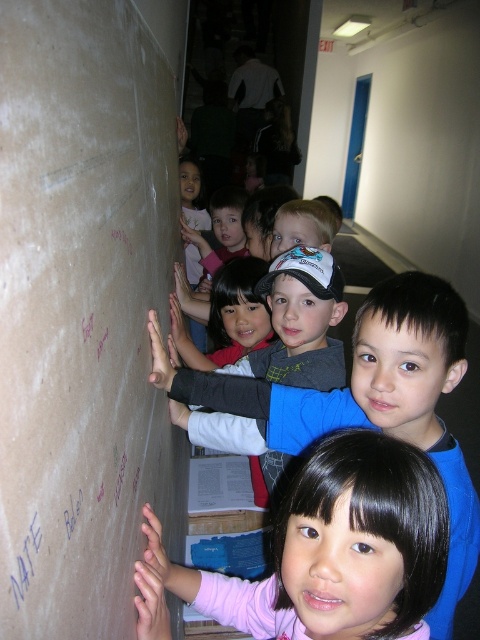
This screenshot has height=640, width=480. Describe the element at coordinates (84, 308) in the screenshot. I see `matte cardboard bulletin board at left` at that location.

Is point (62, 156) behind point (262, 624)?

No, it is in front of (262, 624).

Locate an element on the screen. The height and width of the screenshot is (640, 480). matte cardboard bulletin board at left is located at coordinates click(84, 308).

Is pink fabric shirt at lower center to the left of blue paper at upper left from the viewer's perspective?

Incorrect, pink fabric shirt at lower center is not on the left side of blue paper at upper left.

Does pink fabric shirt at lower center have a greater width compared to blue paper at upper left?

Indeed, pink fabric shirt at lower center has a greater width compared to blue paper at upper left.

Which is behind, point (383, 548) or point (24, 593)?

The point (383, 548) is more distant.

Where is `pink fabric shirt at lower center`? pink fabric shirt at lower center is located at coordinates (336, 548).

Is matte cardboard bulletin board at left positioned in front of blue paper at upper left?

That is True.

Does point (143, 278) lie behind point (31, 572)?

Yes.

What are the coordinates of `matte cardboard bulletin board at left` in the screenshot? It's located at (84, 308).